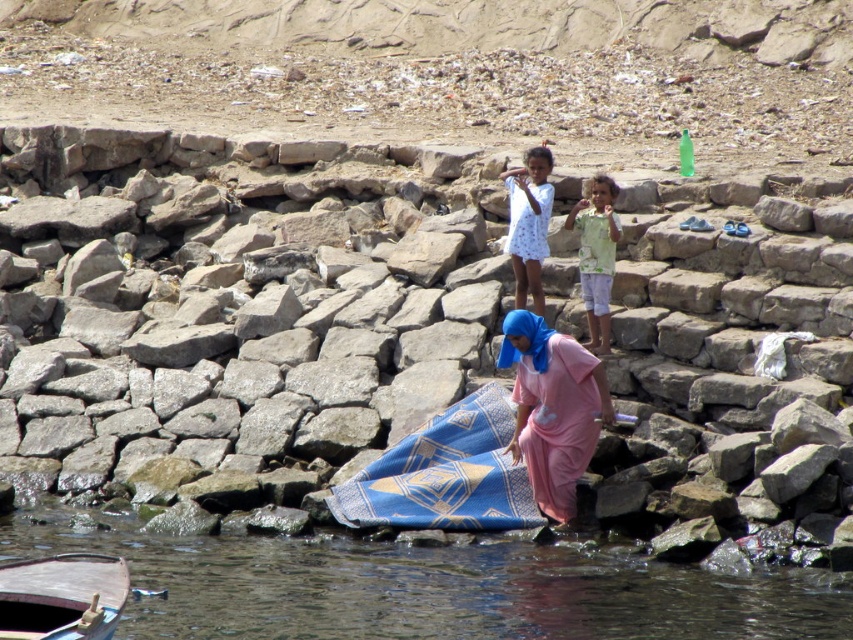
Identify the location of blue fabric at center. Image resolution: width=853 pixels, height=640 pixels. (241, 328).

Describe the element at coordinates (241, 328) in the screenshot. I see `blue fabric at center` at that location.

Locate an element on the screen. This screenshot has height=640, width=853. blue fabric at center is located at coordinates (241, 328).

Can you confirm if blue fabric at center is positioned to the right of pink fabric at center?

Incorrect, blue fabric at center is not on the right side of pink fabric at center.

Is blue fabric at center closer to camera compared to pink fabric at center?

Yes.

You are a GUI agent. You are given a task and a screenshot of the screen. Output one action in this format:
    pyautogui.click(x=<x>, y=<y>)
    Task: Click on the blue fabric at center
    
    Given the screenshot: What is the action you would take?
    pyautogui.click(x=241, y=328)

You are a GUI agent. You are given a task and a screenshot of the screen. Output one action in this format:
    pyautogui.click(x=<x>, y=<y>)
    Task: Click on the blue fabric at center
    The height and width of the screenshot is (640, 853).
    Given the screenshot: What is the action you would take?
    point(241,328)

Who is taller, blue fabric at lower left or wooden boat at lower left?

Standing taller between the two is blue fabric at lower left.

Who is positioned more to the left, blue fabric at lower left or wooden boat at lower left?

wooden boat at lower left

In order to click on blue fabric at lower left in this screenshot , I will do `click(431, 588)`.